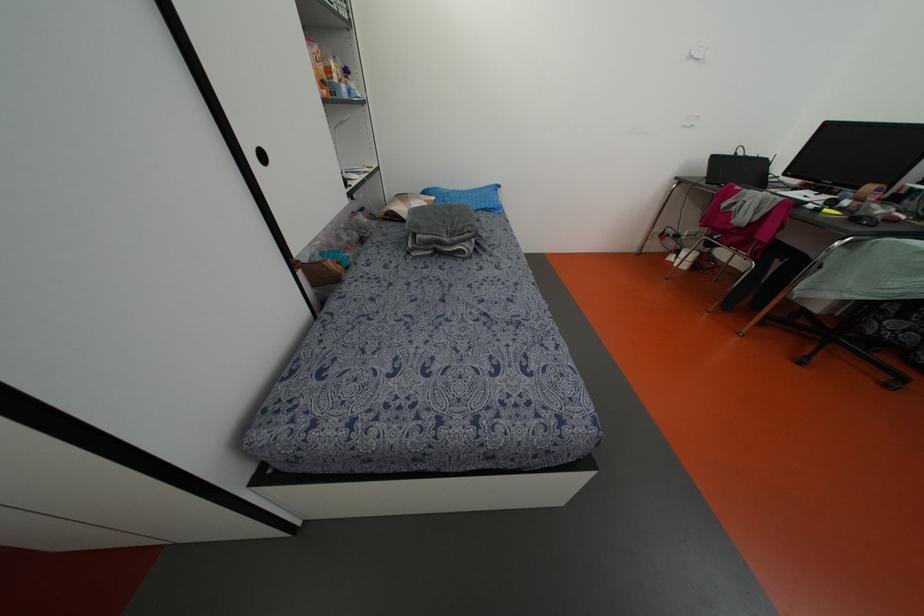
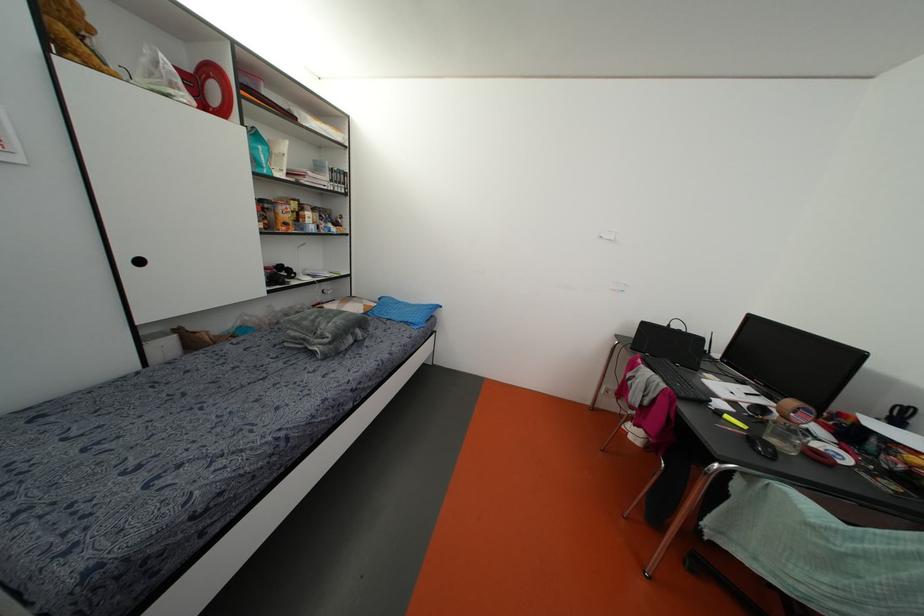
Question: The images are taken continuously from a first-person perspective. In which direction are you moving?

Choices:
 (A) Left
 (B) Right
 (C) Forward
 (D) Backward

Answer: (B)